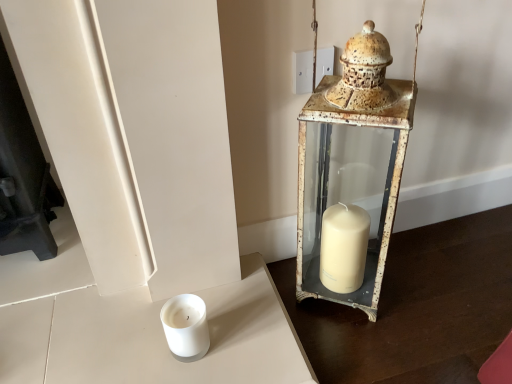
Locate an element on the screen. vacant area to the right of rusty metal lantern at right is located at coordinates (425, 288).